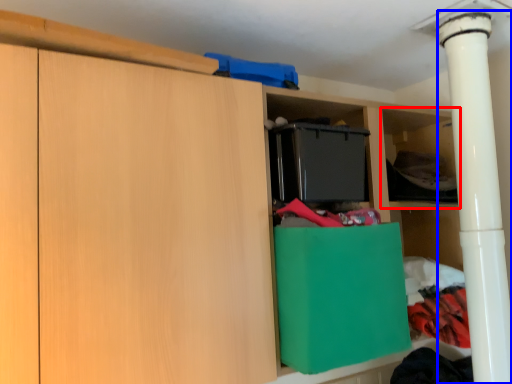
Question: Among these objects, which one is nearest to the camera, shelf (highlighted by a red box) or pillar (highlighted by a blue box)?

Choices:
 (A) shelf
 (B) pillar

Answer: (B)